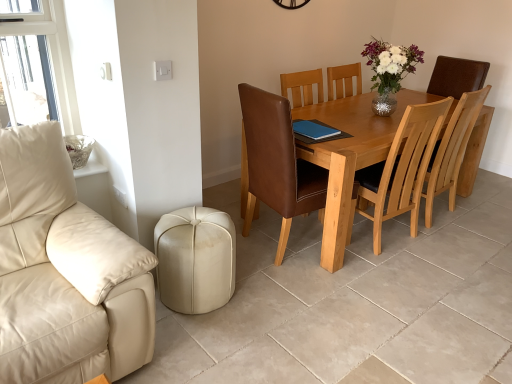
The height and width of the screenshot is (384, 512). I want to click on vacant area in front of beige leather ottoman at lower left, so click(203, 345).